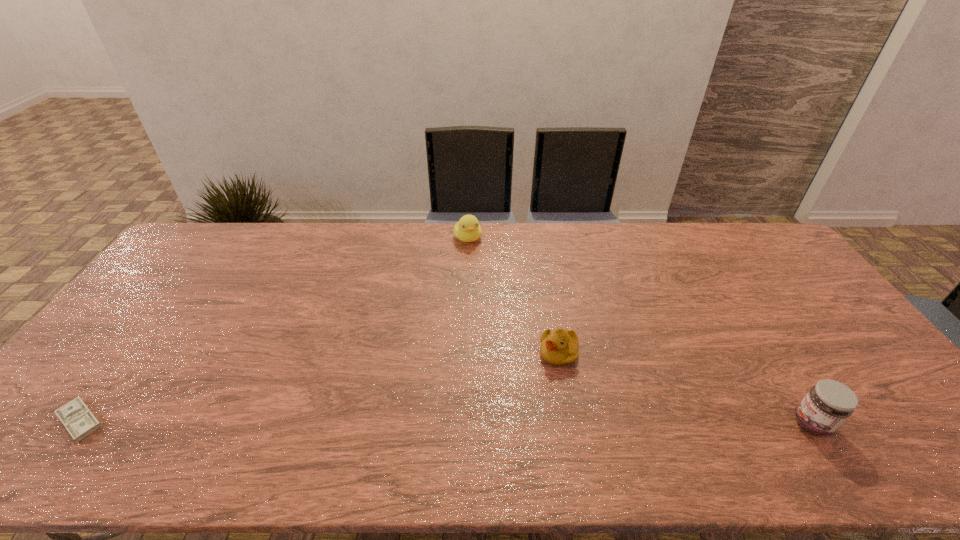
I want to click on object situated at the left edge, so click(x=80, y=422).

Find the location of a particular element. object that is at the near left corner is located at coordinates (80, 422).

Identify the location of vacant space at the far edge of the desktop. This screenshot has height=540, width=960. (581, 254).

I want to click on free location at the near edge, so click(465, 408).

The width and height of the screenshot is (960, 540). In the image, there is a desktop. Find the location of `free space at the left edge`. free space at the left edge is located at coordinates (129, 338).

Locate an element on the screen. vacant area at the right edge is located at coordinates (785, 310).

You are a GUI agent. You are given a task and a screenshot of the screen. Output one action in this format:
    pyautogui.click(x=<x>, y=<y>)
    Task: Click on the free space at the far right corner
    
    Given the screenshot: What is the action you would take?
    pyautogui.click(x=767, y=256)

This screenshot has height=540, width=960. Identify the location of vacant region between the farthest object and the right duckling. pyautogui.click(x=514, y=295).

Identify the location of blank region between the farthest object and the rightmost object. tap(640, 330).

This screenshot has width=960, height=540. I want to click on unoccupied position between the leftmost object and the farther duckling, so click(275, 329).